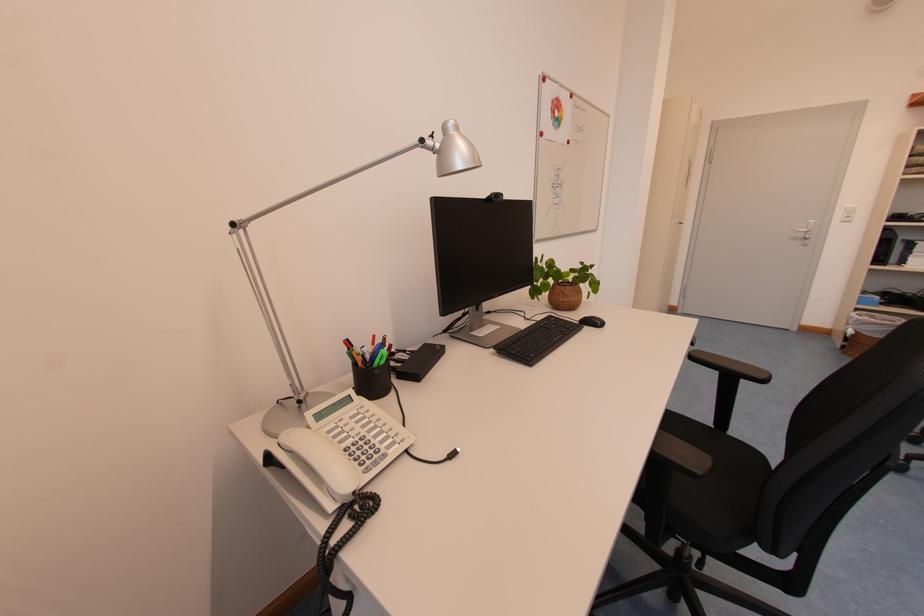
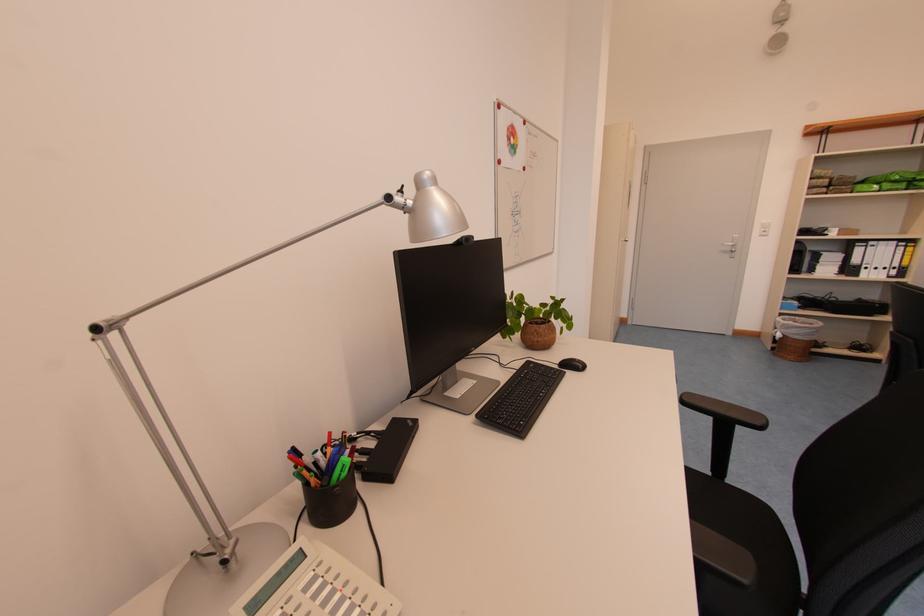
The point at (573,302) is marked in the first image. Where is the corresponding point in the second image?

(546, 342)